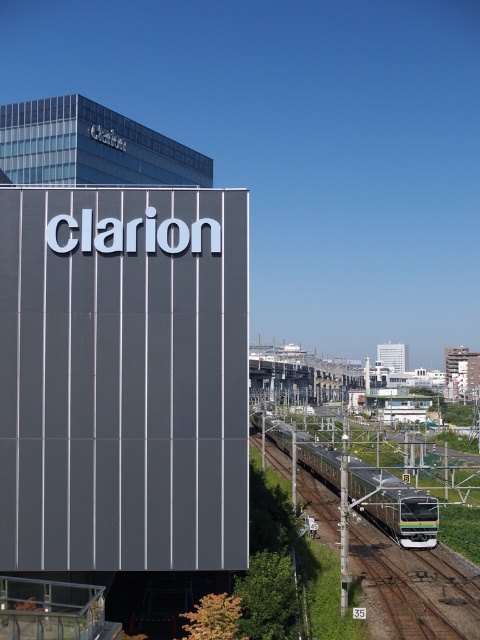
Question: Is the position of green metallic train track at lower center less distant than that of green metallic train at center?

Choices:
 (A) yes
 (B) no

Answer: (A)

Question: Where is green metallic train track at lower center located in relation to green metallic train at center in the image?

Choices:
 (A) above
 (B) below

Answer: (B)

Question: Where is green metallic train track at lower center located in relation to green metallic train at center in the image?

Choices:
 (A) below
 (B) above

Answer: (A)

Question: Which point is closer to the camera?

Choices:
 (A) (335, 522)
 (B) (379, 488)

Answer: (B)